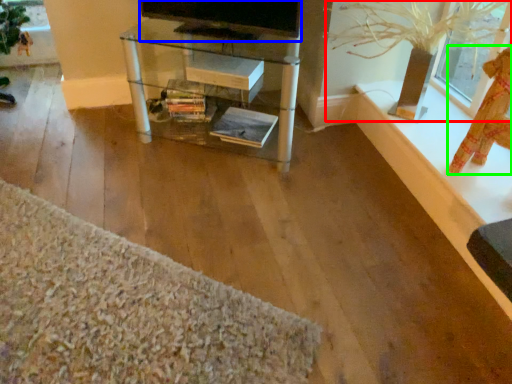
Question: Which object is positioned farthest from plant (highlighted by a red box)? Select from television (highlighted by a blue box) and doll (highlighted by a green box).

Choices:
 (A) television
 (B) doll

Answer: (A)